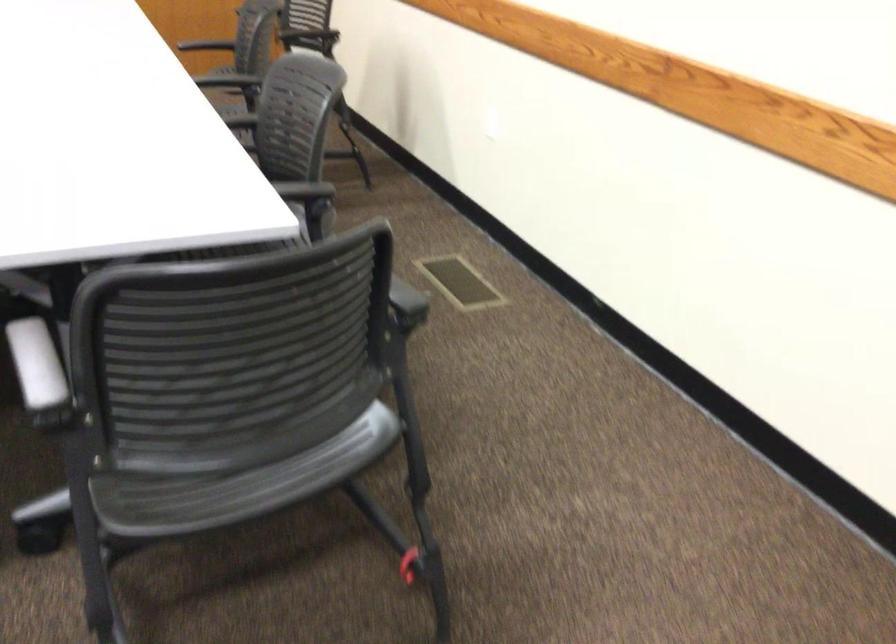
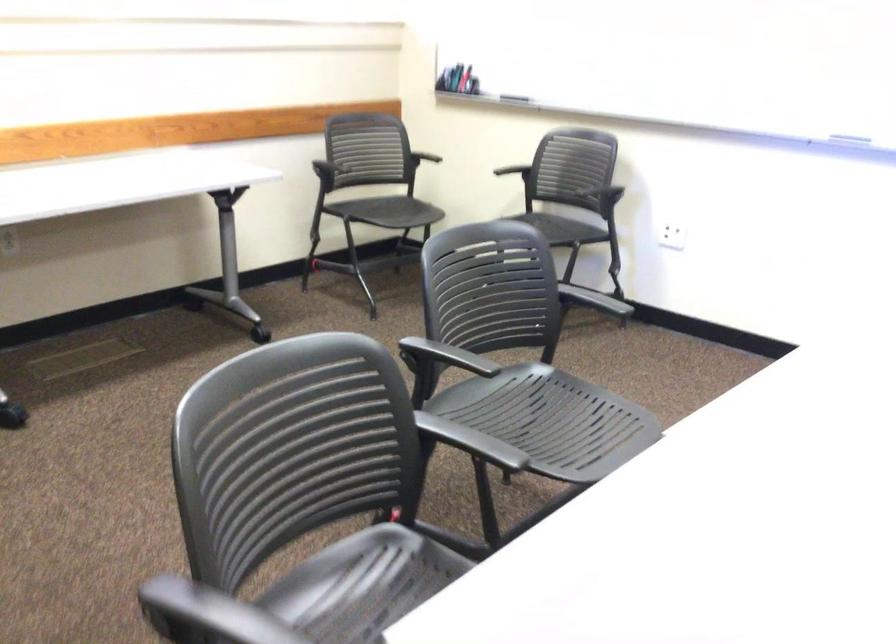
Find the pixel in the second image that matches the point at 191,527 in the first image.

(362, 585)